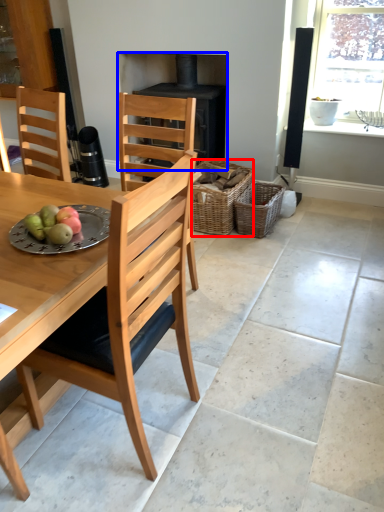
Question: Which of the following is the closest to the observer, basket (highlighted by a red box) or fireplace (highlighted by a blue box)?

Choices:
 (A) basket
 (B) fireplace

Answer: (A)